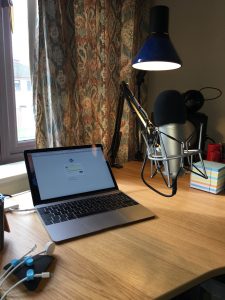
This screenshot has height=300, width=225. Identify the location of cables. (31, 250), (39, 252), (37, 275).